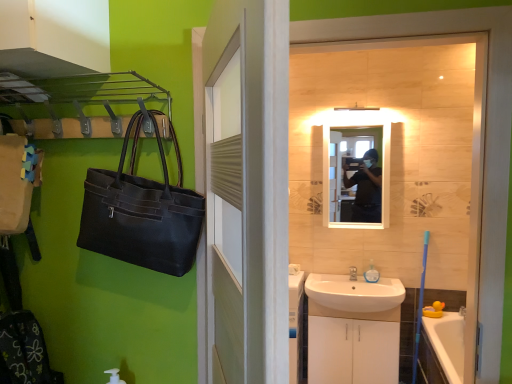
Question: Is the depth of white wood door at center greater than that of white glossy cabinet at lower center?

Choices:
 (A) no
 (B) yes

Answer: (A)

Question: Can you confirm if white wood door at center is bigger than white glossy cabinet at lower center?

Choices:
 (A) no
 (B) yes

Answer: (A)

Question: From the image's perspective, is white wood door at center on top of white glossy cabinet at lower center?

Choices:
 (A) yes
 (B) no

Answer: (A)

Question: Can you confirm if white wood door at center is wider than white glossy cabinet at lower center?

Choices:
 (A) no
 (B) yes

Answer: (A)

Question: Is white wood door at center completely or partially outside of white glossy cabinet at lower center?

Choices:
 (A) no
 (B) yes

Answer: (B)

Question: Is white wood door at center at the right side of white glossy cabinet at lower center?

Choices:
 (A) yes
 (B) no

Answer: (B)

Question: Does white wood door at center have a larger size compared to translucent plastic soap dispenser at sink?

Choices:
 (A) no
 (B) yes

Answer: (B)

Question: From the image's perspective, would you say white wood door at center is shown under translucent plastic soap dispenser at sink?

Choices:
 (A) no
 (B) yes

Answer: (A)

Question: Is white wood door at center thinner than translucent plastic soap dispenser at sink?

Choices:
 (A) no
 (B) yes

Answer: (A)

Question: Considering the relative sizes of white wood door at center and translucent plastic soap dispenser at sink in the image provided, is white wood door at center smaller than translucent plastic soap dispenser at sink?

Choices:
 (A) yes
 (B) no

Answer: (B)

Question: Is white wood door at center wider than translucent plastic soap dispenser at sink?

Choices:
 (A) yes
 (B) no

Answer: (A)

Question: Is white wood door at center positioned in front of translucent plastic soap dispenser at sink?

Choices:
 (A) no
 (B) yes

Answer: (B)

Question: Is white wood door at center to the right of white ceramic sink at lower center from the viewer's perspective?

Choices:
 (A) yes
 (B) no

Answer: (B)